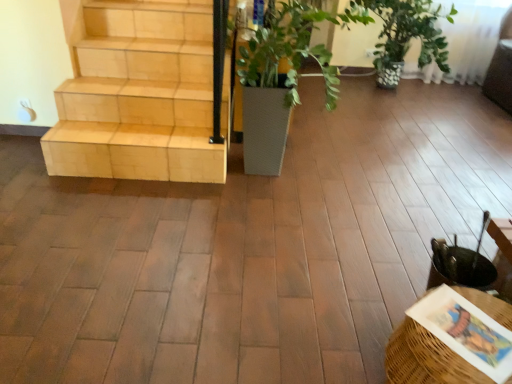
The width and height of the screenshot is (512, 384). In order to click on free space underneath woven wood table at lower right (from a real-world perspective) in this screenshot , I will do `click(464, 330)`.